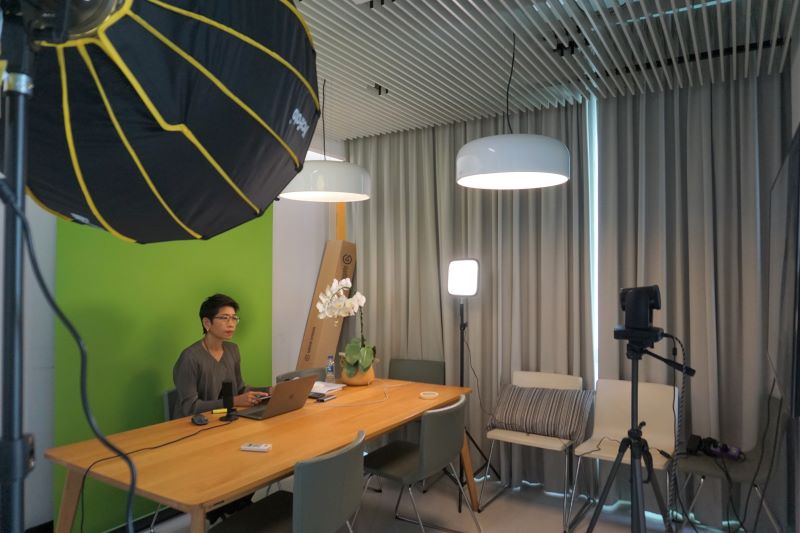
At what (x,y) coordinates should I click in order to perform the action: click on lights. Please return your answer as a coordinate pair (x, y). Image resolution: width=800 pixels, height=533 pixels. Looking at the image, I should click on (460, 282), (521, 168), (317, 199).